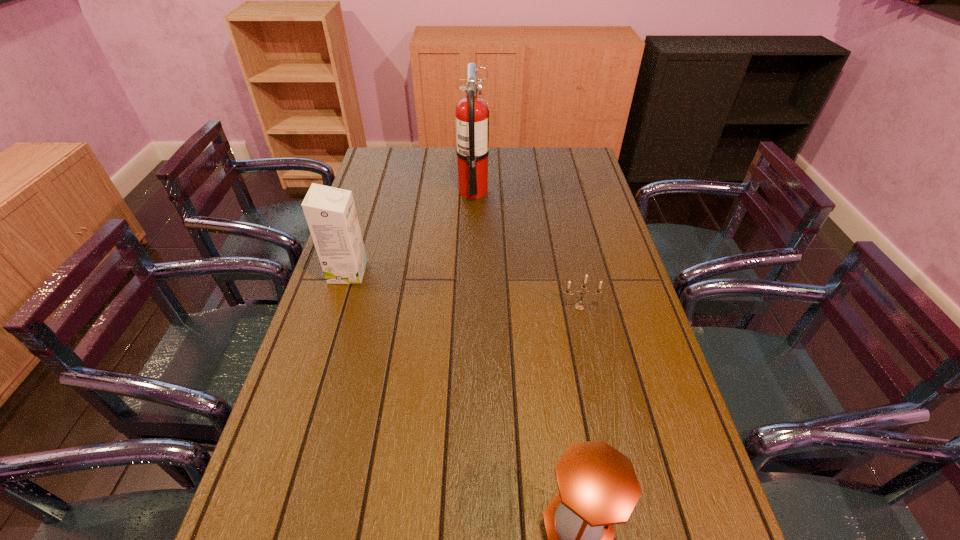
Locate an element on the screen. fire extinguisher is located at coordinates (472, 112).

Locate an element on the screen. the second object from left to right is located at coordinates (472, 112).

This screenshot has width=960, height=540. I want to click on the leftmost object, so click(x=330, y=212).

The height and width of the screenshot is (540, 960). What are the coordinates of `carton` in the screenshot? It's located at (330, 212).

Locate an element on the screen. the second nearest object is located at coordinates (579, 306).

I want to click on the shortest object, so click(579, 306).

Identify the location of free space located 0.290m on the nozzle side of the third object from right to left. The height and width of the screenshot is (540, 960). (564, 191).

This screenshot has width=960, height=540. In order to click on blank space located on the right of the carton in this screenshot , I will do [x=448, y=272].

Identify the location of vacant space located 0.110m on the left of the second nearest object. This screenshot has height=540, width=960. (523, 307).

The height and width of the screenshot is (540, 960). I want to click on object situated at the far edge, so click(x=472, y=112).